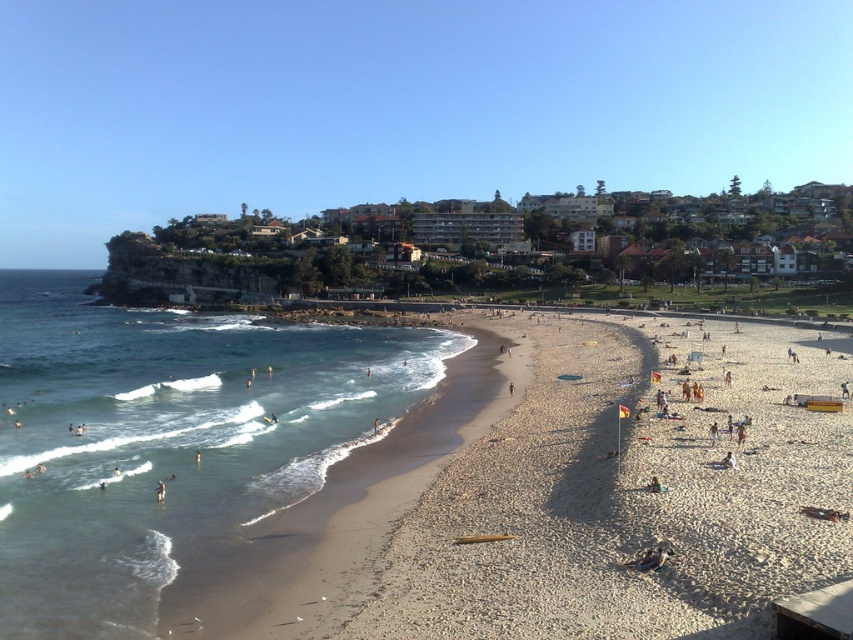
Question: Where is light brown gravel at center located in relation to clear blue water at lower left in the image?

Choices:
 (A) above
 (B) below

Answer: (B)

Question: Considering the real-world distances, which object is closest to the dark brown leather bag at lower center?

Choices:
 (A) green fabric person at lower right
 (B) clear blue water at lower left
 (C) light brown gravel at center

Answer: (A)

Question: Does light brown gravel at center have a lesser width compared to dark brown leather bag at lower center?

Choices:
 (A) no
 (B) yes

Answer: (A)

Question: Which object is positioned farthest from the green fabric person at lower right?

Choices:
 (A) light brown skin at beach center
 (B) light brown gravel at center

Answer: (B)

Question: In this image, where is clear blue water at lower left located relative to light brown skin at beach center?

Choices:
 (A) above
 (B) below

Answer: (A)

Question: Considering the real-world distances, which object is farthest from the green fabric person at lower right?

Choices:
 (A) clear blue water at lower left
 (B) dark brown leather bag at lower center

Answer: (A)